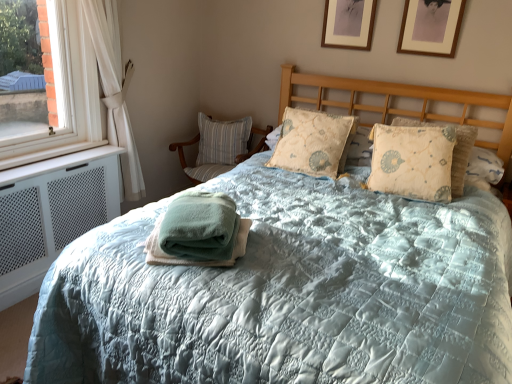
Question: Considering their positions, is green cotton towel at center located in front of or behind striped fabric pillow at left, the 1th pillow viewed from the back?

Choices:
 (A) behind
 (B) front

Answer: (B)

Question: Is point (231, 233) closer or farther from the camera than point (224, 140)?

Choices:
 (A) closer
 (B) farther

Answer: (A)

Question: Which object is the closest to the beige quilted pillow at center, the second pillow in the back-to-front sequence?

Choices:
 (A) beige textured pillow at center, marked as the first pillow in a right-to-left arrangement
 (B) striped fabric chair at left
 (C) white sheer curtain at left
 (D) white mesh air conditioner at left
 (E) striped fabric pillow at left, the 1th pillow viewed from the back

Answer: (A)

Question: Estimate the real-world distances between objects in this image. Which object is farther from the beige quilted pillow at center, the second pillow in the back-to-front sequence?

Choices:
 (A) green cotton towel at center
 (B) beige textured pillow at center, the third pillow from the left
 (C) wooden picture frame at upper right, the second picture frame from the right
 (D) white sheer curtain at left
 (E) striped fabric pillow at left, the third pillow when ordered from front to back

Answer: (D)